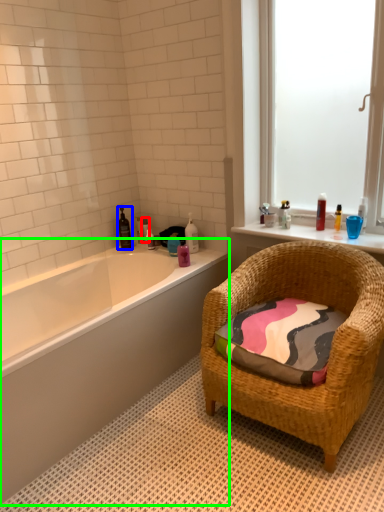
Question: Which object is the farthest from toiletry (highlighted by a red box)? Choose among these: toiletry (highlighted by a blue box) or bathtub (highlighted by a green box).

Choices:
 (A) toiletry
 (B) bathtub

Answer: (B)